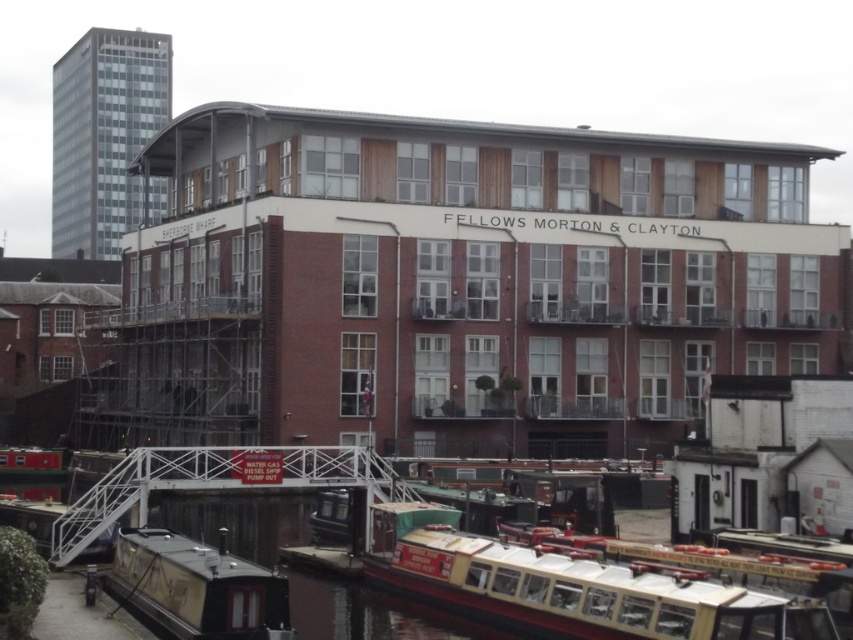
You are a tour guide leading a group near the canal. You want to show them the larger boat between the white wooden boat at lower center and the wooden polished boat at lower left. Which boat should you point to?

The white wooden boat at lower center is bigger than the wooden polished boat at lower left, so you should point to the white wooden boat at lower center.

You are standing on the small bridge in front of the building and want to take a photo of both the white wooden boat at lower center and the wooden polished boat at lower left. Which boat should you position yourself closer to in order to frame both in your camera viewfinder?

To frame both the white wooden boat at lower center and the wooden polished boat at lower left in your camera viewfinder, you should position yourself closer to the wooden polished boat at lower left since the white wooden boat at lower center is to the right of it, allowing both to be captured within the frame when centered on the left boat.

Consider the image. You are standing in front of the multi story building with a modern architectural design. You want to take a photo of the point at coordinates (447, 579). If your camera has a maximum focus range of 30 meters, will you be able to focus on that point?

The distance of point (447, 579) from camera is 34.01 meters, which is beyond the camera maximum focus range of 30 meters. So you won not be able to focus on that point.